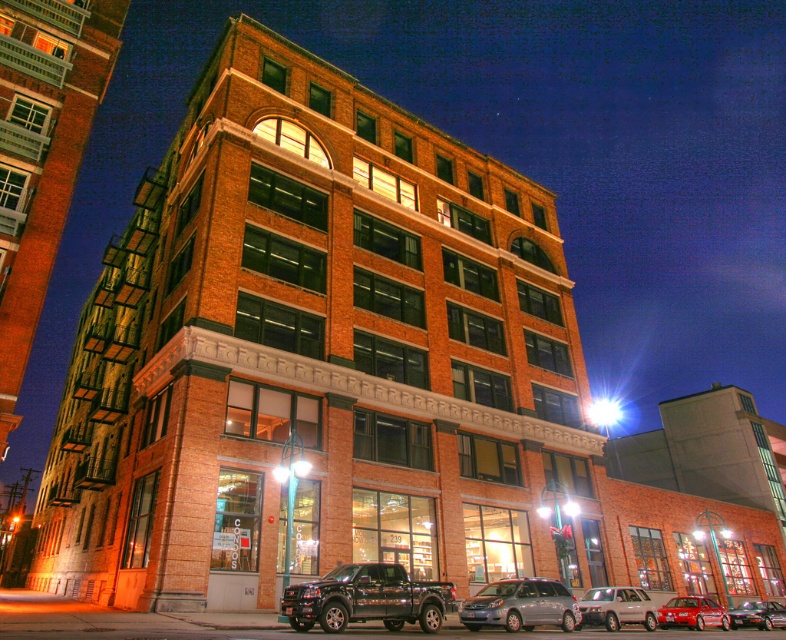
Question: Does satin silver van at center appear on the right side of silver metallic suv at center?

Choices:
 (A) no
 (B) yes

Answer: (A)

Question: Estimate the real-world distances between objects in this image. Which object is farther from the satin silver van at center?

Choices:
 (A) shiny black truck at center
 (B) metallic silver sedan at center
 (C) silver metallic suv at center
 (D) shiny red sedan at lower right

Answer: (B)

Question: Estimate the real-world distances between objects in this image. Which object is farther from the silver metallic suv at center?

Choices:
 (A) shiny red sedan at lower right
 (B) shiny black truck at center
 (C) satin silver van at center

Answer: (B)

Question: Which point is farther to the camera?

Choices:
 (A) satin silver van at center
 (B) shiny black truck at center
 (C) shiny red sedan at lower right
 (D) silver metallic suv at center

Answer: (C)

Question: Is satin silver van at center thinner than metallic silver sedan at center?

Choices:
 (A) no
 (B) yes

Answer: (B)

Question: Does shiny red sedan at lower right appear on the right side of metallic silver sedan at center?

Choices:
 (A) yes
 (B) no

Answer: (B)